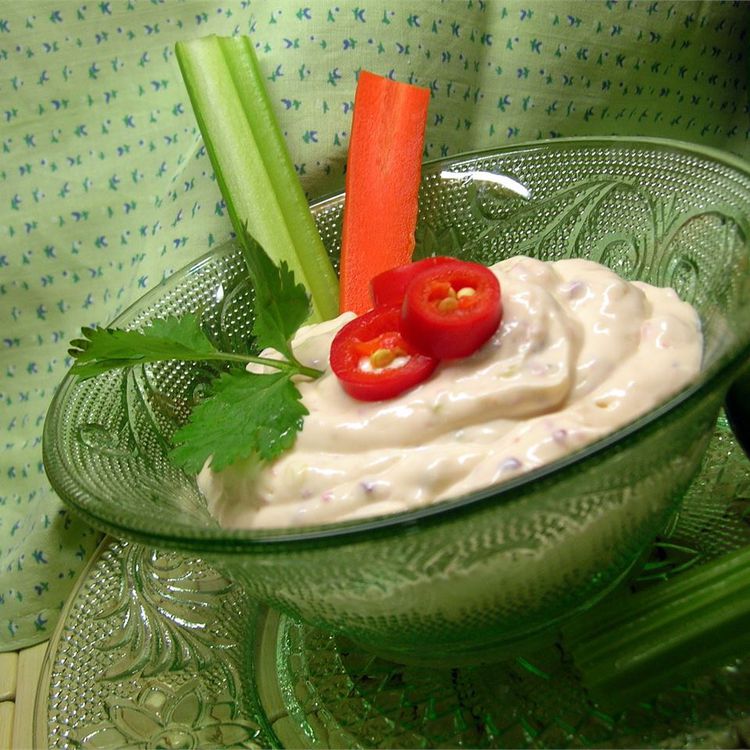
The width and height of the screenshot is (750, 750). In order to click on green glass bowl in this screenshot , I will do `click(358, 578)`.